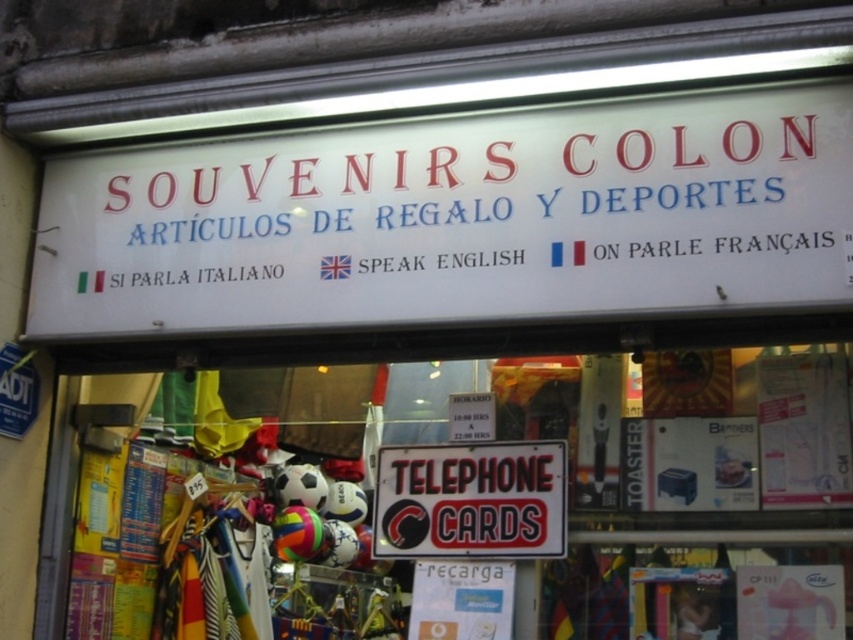
Does white plastic telephone cards at center have a larger size compared to black plastic telephone cards at center?

Indeed, white plastic telephone cards at center has a larger size compared to black plastic telephone cards at center.

Does white plastic telephone cards at center come behind black plastic telephone cards at center?

That is False.

Between point (561, 401) and point (563, 545), which one is positioned in front?

Positioned in front is point (563, 545).

Locate an element on the screen. white plastic telephone cards at center is located at coordinates (711, 512).

Who is positioned more to the right, white plastic sign at upper center or white plastic telephone cards at center?

Positioned to the right is white plastic telephone cards at center.

Does white plastic sign at upper center have a larger size compared to white plastic telephone cards at center?

Correct, white plastic sign at upper center is larger in size than white plastic telephone cards at center.

The width and height of the screenshot is (853, 640). In order to click on white plastic sign at upper center in this screenshot , I will do `click(457, 218)`.

In the scene shown: Can you confirm if white plastic sign at upper center is positioned below black plastic telephone cards at center?

Actually, white plastic sign at upper center is above black plastic telephone cards at center.

Locate an element on the screen. This screenshot has height=640, width=853. white plastic sign at upper center is located at coordinates (457, 218).